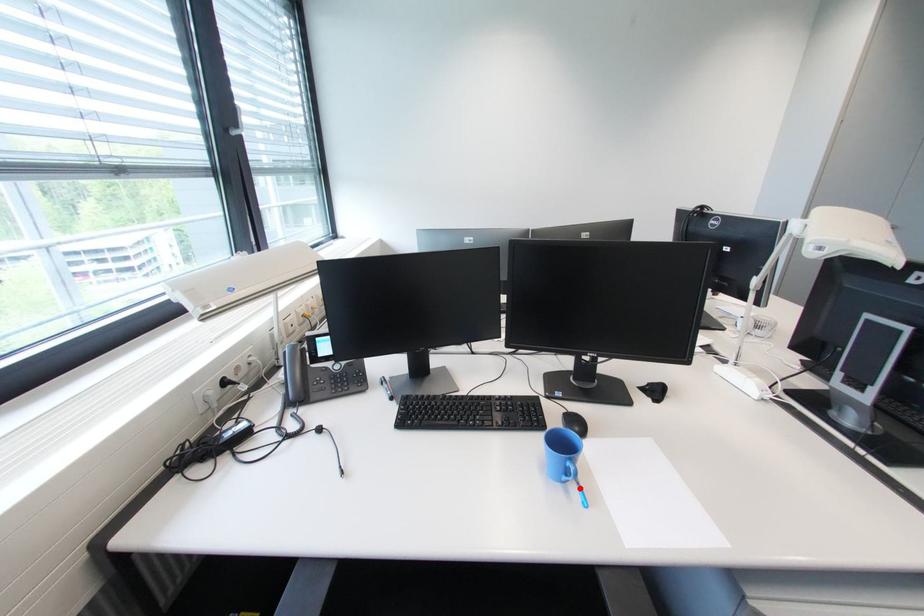
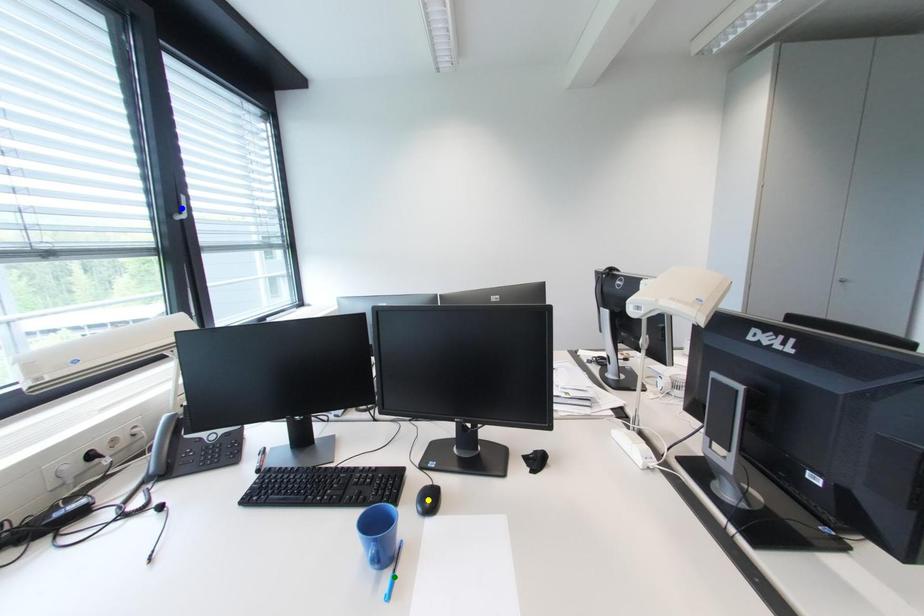
Question: I am providing you with two images of the same scene from different viewpoints. A red point is marked on the first image. You are given multiple points on the second image. Which point in image 2 represents the same 3d spot as the red point in image 1?

Choices:
 (A) blue point
 (B) yellow point
 (C) green point

Answer: (C)